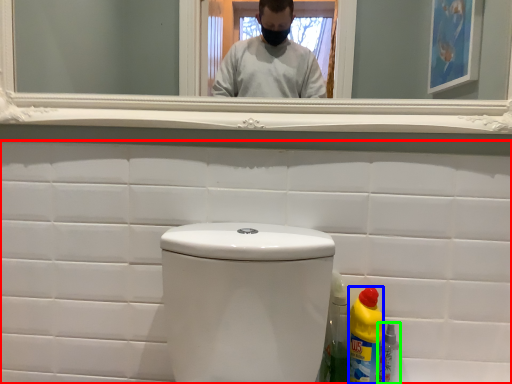
Question: Which object is positioned farthest from porcelain (highlighted by a red box)? Select from bottle (highlighted by a blue box) and bottle (highlighted by a green box).

Choices:
 (A) bottle
 (B) bottle

Answer: (B)